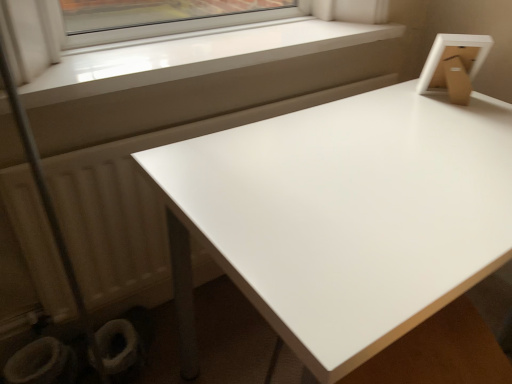
Find the location of a particular element. The height and width of the screenshot is (384, 512). blank space situated above white matte radiator at lower left (from a real-world perspective) is located at coordinates (140, 135).